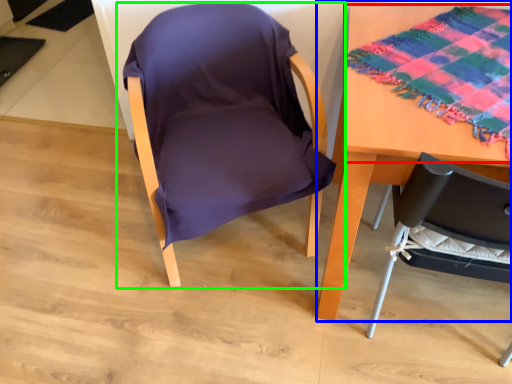
Question: Estimate the real-world distances between objects in this image. Which object is farther from blanket (highlighted by a red box), table (highlighted by a blue box) or chair (highlighted by a green box)?

Choices:
 (A) table
 (B) chair

Answer: (B)